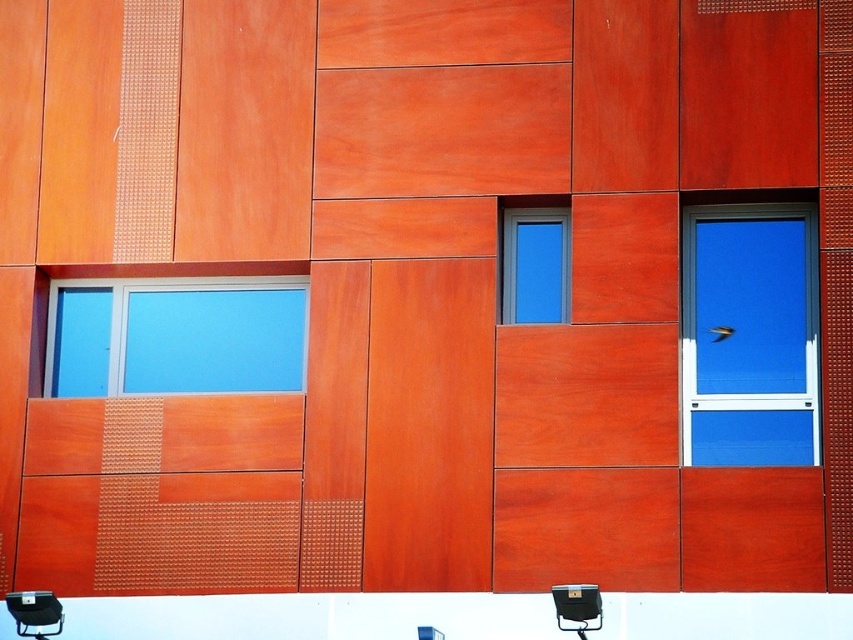
You are standing 100 feet away from a modern building exterior. You want to touch the point at coordinates point (543, 307) on the wall. Can you reach it without moving closer?

The point (543, 307) is 97.67 feet from the viewer. Since you are standing 100 feet away, the distance is slightly less than your current position, so you can reach it without moving closer.

You are an architect designing a new building and want to ensure that the matte blue glass window at center and the metallic black chair at lower right are proportionally balanced. Given their sizes, which object should be placed closer to the entrance to maintain visual harmony?

The matte blue glass window at center is larger in size than the metallic black chair at lower right. To maintain visual harmony, the larger matte blue glass window at center should be placed closer to the entrance, as its size will draw attention and balance the composition.